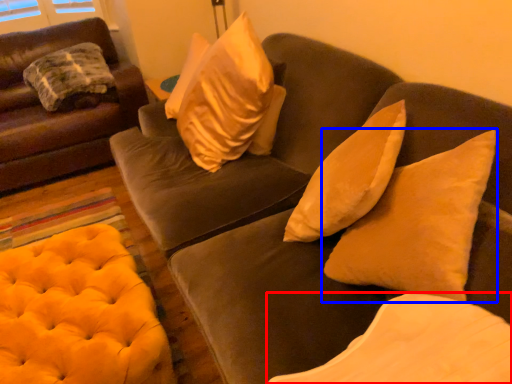
Question: Which object is closer to the camera taking this photo, pillow (highlighted by a red box) or pillow (highlighted by a blue box)?

Choices:
 (A) pillow
 (B) pillow

Answer: (A)